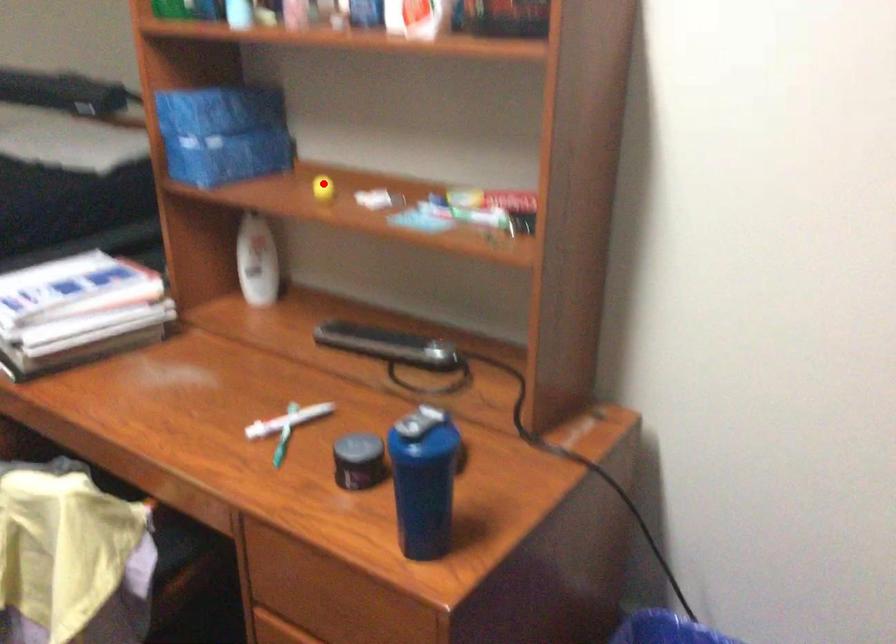
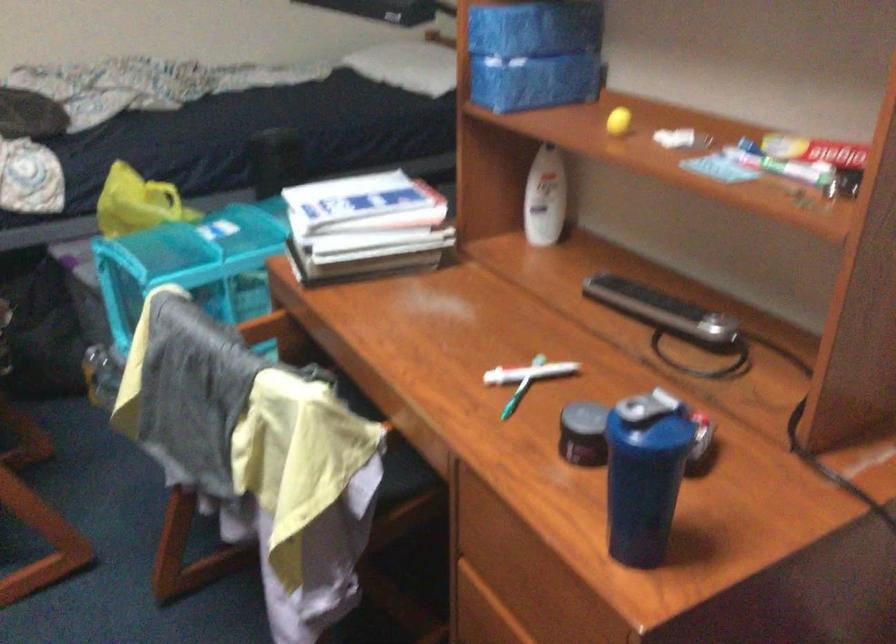
Question: I am providing you with two images of the same scene from different viewpoints. Image1 has a red point marked. In image2, the corresponding 3D location appears at what relative position? Reply with the corresponding letter.

Choices:
 (A) Closer
 (B) Farther

Answer: (A)